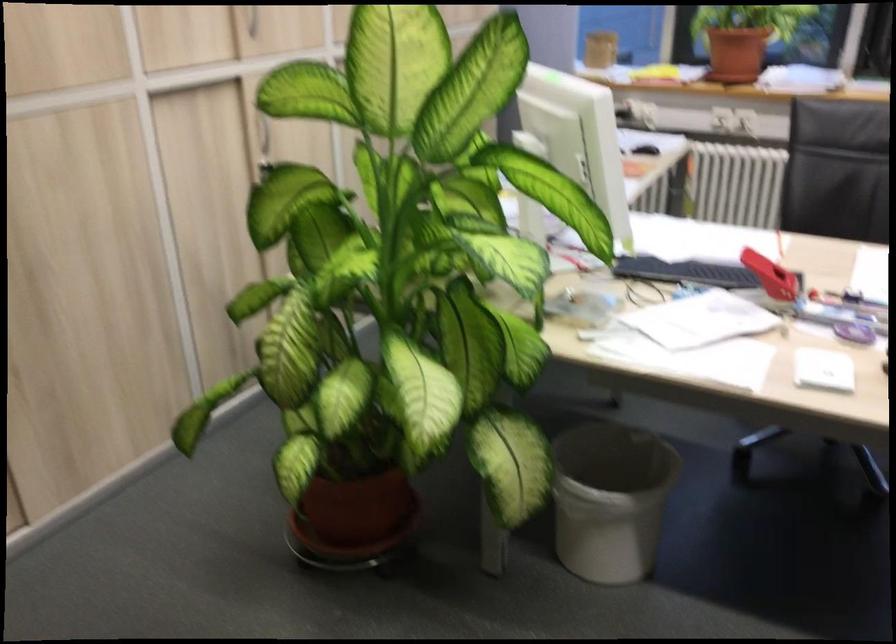
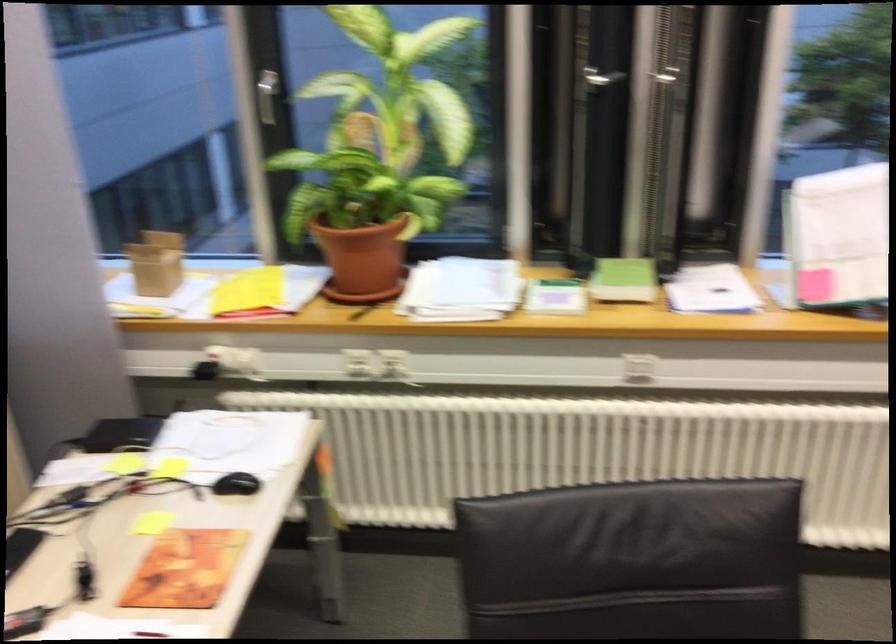
In a continuous first-person perspective shot, in which direction is the camera moving?

The cameraman moved toward right, forward.